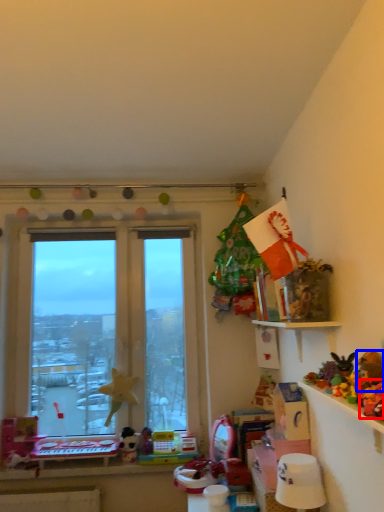
Question: Which object is closer to the camera taking this photo, toy (highlighted by a red box) or toy (highlighted by a blue box)?

Choices:
 (A) toy
 (B) toy

Answer: (A)